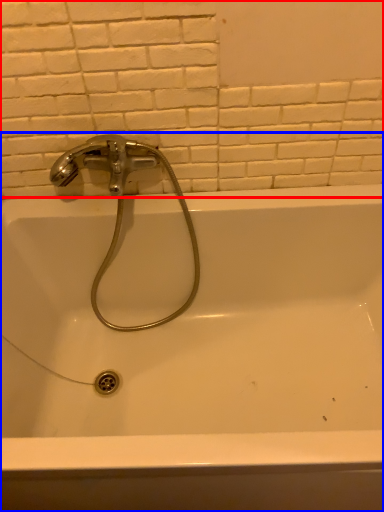
Question: Which of the following is the farthest to the observer, ceramic tile (highlighted by a red box) or bathtub (highlighted by a blue box)?

Choices:
 (A) ceramic tile
 (B) bathtub

Answer: (A)